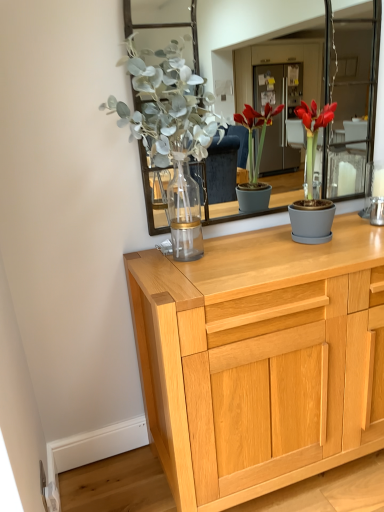
Locate an element on the screen. empty space that is ontop of light oak wooden chest of drawers at center (from a real-world perspective) is located at coordinates (287, 249).